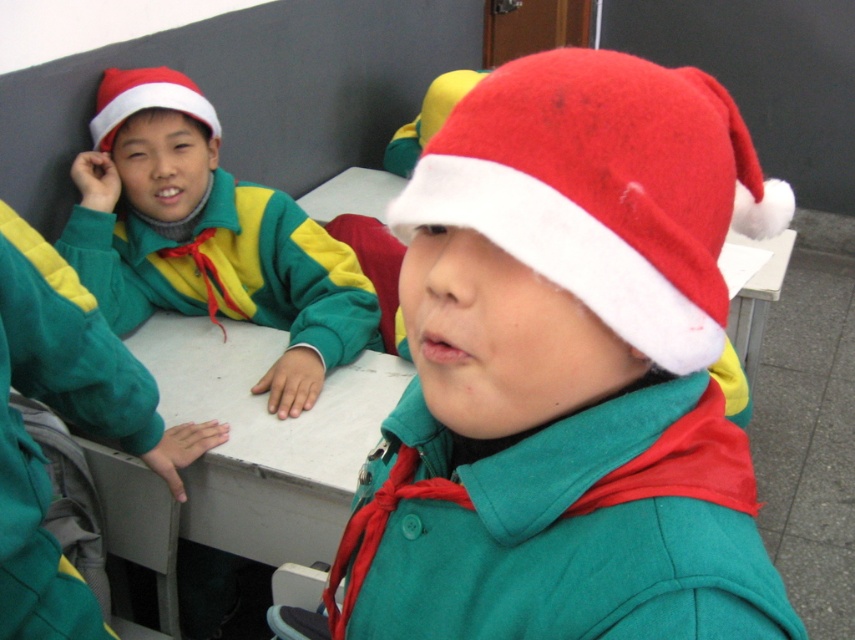
Question: Observing the image, what is the correct spatial positioning of felt santa hat at center in reference to white matte table at center?

Choices:
 (A) above
 (B) below

Answer: (A)

Question: Which of these objects is positioned closest to the white matte table at center?

Choices:
 (A) matte red santa hat at upper left
 (B) red felt santa hat at center
 (C) matte green jacket at center
 (D) felt santa hat at center

Answer: (C)

Question: Is white matte table at center below matte red santa hat at upper left?

Choices:
 (A) yes
 (B) no

Answer: (A)

Question: Which point is farther from the camera taking this photo?

Choices:
 (A) (624, 234)
 (B) (611, 396)
 (C) (268, 397)
 (D) (163, 76)

Answer: (D)

Question: Which point is closer to the camera taking this photo?

Choices:
 (A) (183, 106)
 (B) (513, 413)

Answer: (B)

Question: Considering the relative positions of red felt santa hat at center and matte green jacket at center in the image provided, where is red felt santa hat at center located with respect to matte green jacket at center?

Choices:
 (A) below
 (B) above

Answer: (A)